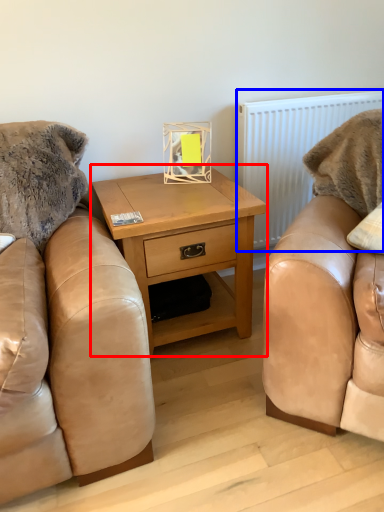
Question: Which object is further to the camera taking this photo, nightstand (highlighted by a red box) or radiator (highlighted by a blue box)?

Choices:
 (A) nightstand
 (B) radiator

Answer: (B)